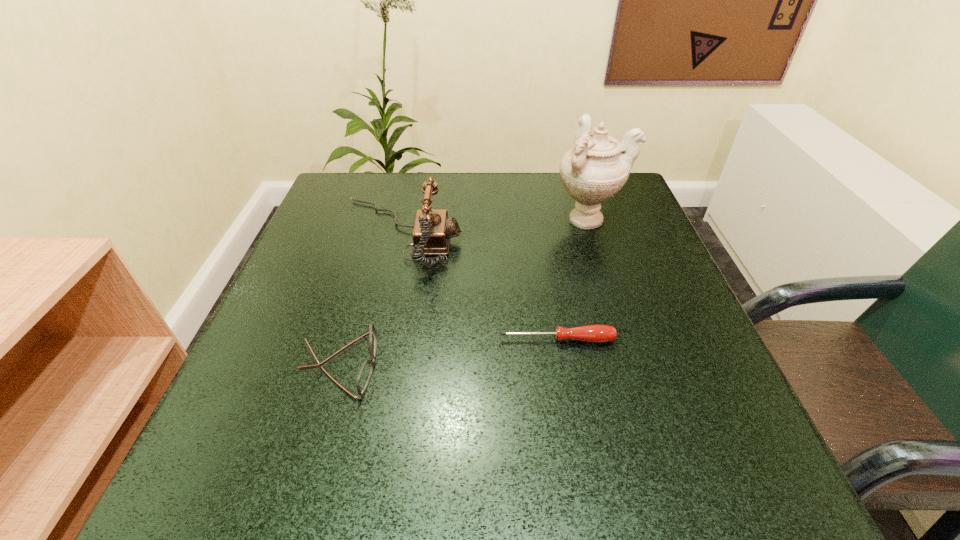
Image resolution: width=960 pixels, height=540 pixels. I want to click on urn, so click(597, 166).

At what (x,y) coordinates should I click in order to perform the action: click on telephone. Please return your answer as a coordinate pair (x, y). The width and height of the screenshot is (960, 540). Looking at the image, I should click on (432, 231).

Image resolution: width=960 pixels, height=540 pixels. What are the coordinates of `spectacles` in the screenshot? It's located at (365, 373).

In order to click on the shortest object in this screenshot , I will do `click(592, 333)`.

At what (x,y) coordinates should I click in order to perform the action: click on vacant space located on the front of the tallest object. Please return your answer as a coordinate pair (x, y). The height and width of the screenshot is (540, 960). Looking at the image, I should click on (599, 256).

The width and height of the screenshot is (960, 540). What are the coordinates of `vacant area situated on the dial of the third shortest object` in the screenshot? It's located at (534, 234).

The width and height of the screenshot is (960, 540). I want to click on vacant space located 0.230m on the front-facing side of the spectacles, so click(x=516, y=365).

You are a GUI agent. You are given a task and a screenshot of the screen. Output one action in this format:
    pyautogui.click(x=<x>, y=<y>)
    Task: Click on the free region located 0.290m on the left of the screwdriver
    This screenshot has width=960, height=540.
    Given the screenshot: What is the action you would take?
    pyautogui.click(x=330, y=340)

In order to click on urn that is at the far edge in this screenshot , I will do `click(597, 166)`.

Find the location of a particular element. The image size is (960, 540). telephone that is at the far edge is located at coordinates (432, 231).